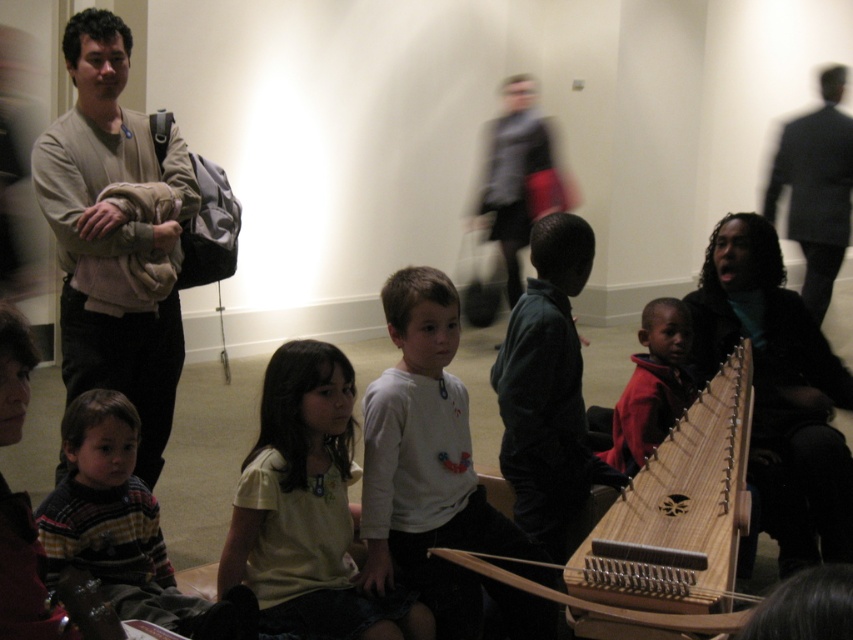
Who is lower down, light yellow shirt at center or matte black jacket at lower right?

light yellow shirt at center is below.

Measure the distance between light yellow shirt at center and camera.

They are 5.85 feet apart.

Which is behind, point (285, 356) or point (805, 353)?

The point (805, 353) is behind.

In order to click on light yellow shirt at center in this screenshot , I will do `click(306, 509)`.

In the scene shown: Can you confirm if white matte shirt at center is wider than light yellow shirt at center?

Incorrect, white matte shirt at center's width does not surpass light yellow shirt at center's.

Does white matte shirt at center have a lesser width compared to light yellow shirt at center?

Yes.

The height and width of the screenshot is (640, 853). What do you see at coordinates (434, 474) in the screenshot? I see `white matte shirt at center` at bounding box center [434, 474].

Find the location of a particular element. The width and height of the screenshot is (853, 640). white matte shirt at center is located at coordinates 434,474.

Can you confirm if matte black jacket at lower right is positioned to the left of red fleece jacket at lower center?

In fact, matte black jacket at lower right is to the right of red fleece jacket at lower center.

Between matte black jacket at lower right and red fleece jacket at lower center, which one is positioned higher?

matte black jacket at lower right

Identify the location of matte black jacket at lower right. This screenshot has width=853, height=640. (779, 390).